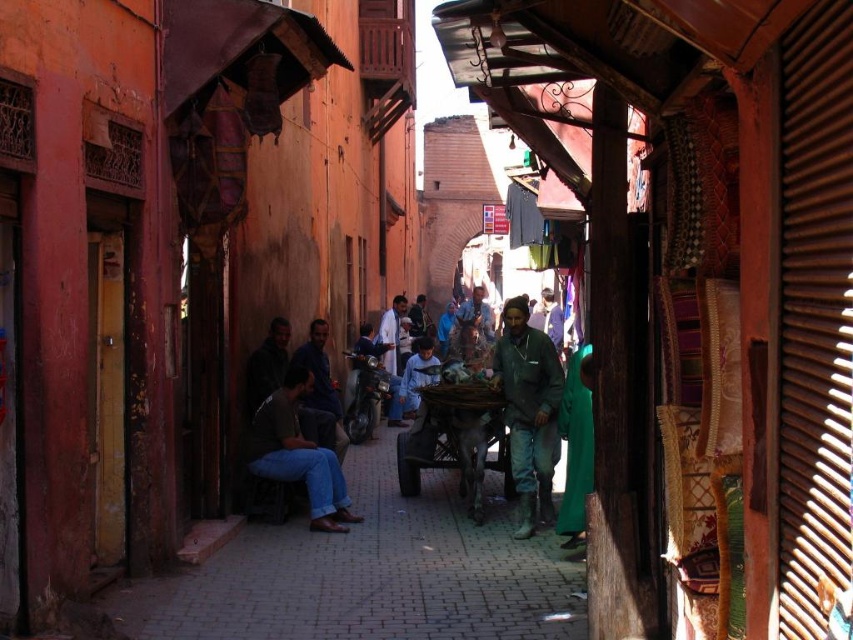
Question: Does dark blue jeans at center have a greater width compared to white clothed man at center?

Choices:
 (A) no
 (B) yes

Answer: (B)

Question: Based on their relative distances, which object is farther from the dark brown leather shoes at lower center?

Choices:
 (A) dark blue jeans at center
 (B) dark brown leather jacket at center
 (C) white clothed man at center
 (D) green matte jacket at center

Answer: (C)

Question: From the image, what is the correct spatial relationship of dark brown leather shoes at lower center in relation to dark brown leather jacket at center?

Choices:
 (A) left
 (B) right

Answer: (B)

Question: Which point is closer to the camera taking this photo?

Choices:
 (A) (395, 416)
 (B) (315, 474)

Answer: (B)

Question: Which point is closer to the camera taking this photo?

Choices:
 (A) (265, 385)
 (B) (286, 468)

Answer: (B)

Question: In this image, where is green matte jacket at center located relative to dark brown leather shoes at lower center?

Choices:
 (A) above
 (B) below

Answer: (B)